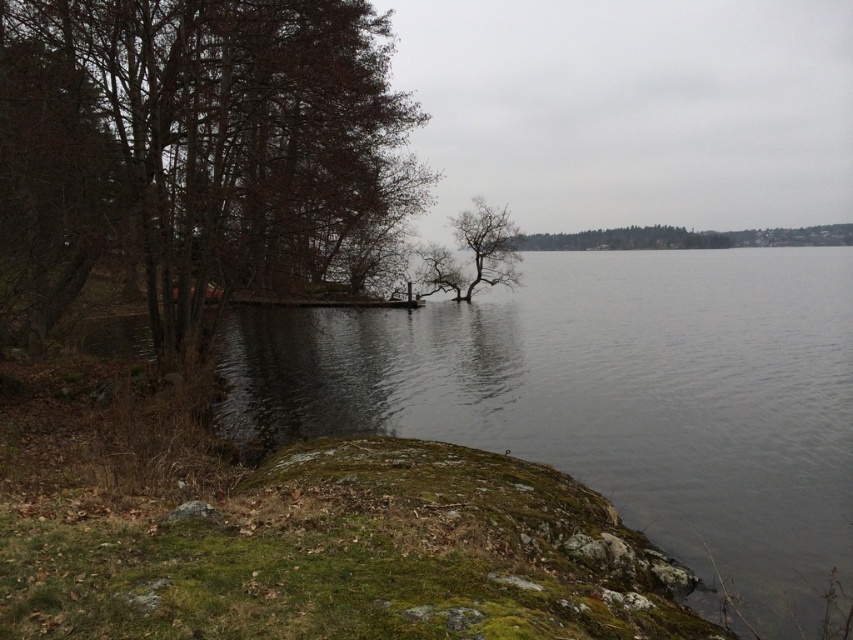
You are standing at the edge of the lakeside scene described. You see the clear water at lower left and the brown leafy tree at left. Which object is positioned to the right of the other?

The clear water at lower left is to the right of the brown leafy tree at left.

You are standing at the point marked as point (199, 145) in the image. What object is located exactly at that point?

The brown leafy tree at left is located exactly at point (199, 145).

You are a photographer standing at the center of the scene. You want to capture a closeup of the clear water at lower left. Which direction should you move to get closer to it?

The clear water at lower left is located at point 0.622 on the x axis and 0.715 on the y axis. Since you are at the center, you should move towards the lower left direction to get closer to the clear water at lower left.